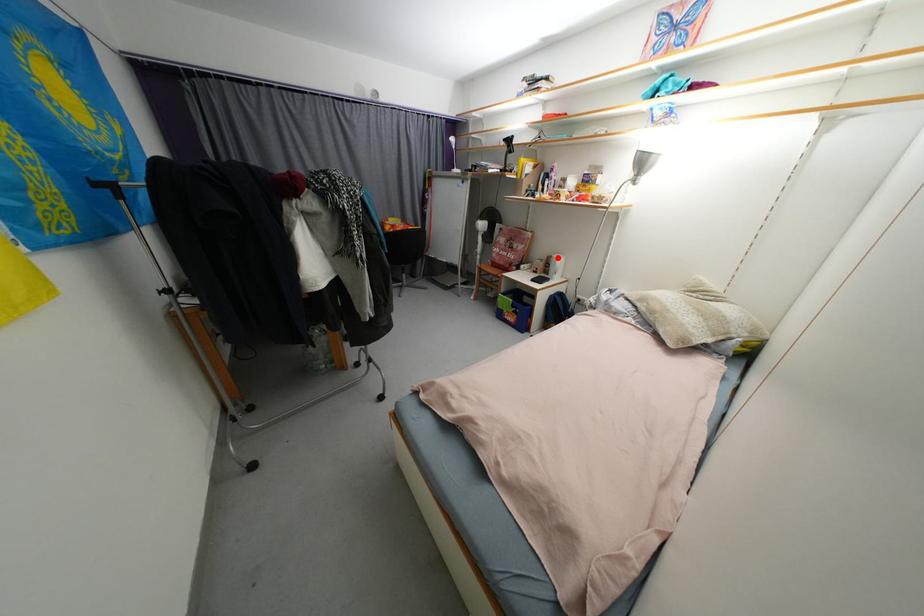
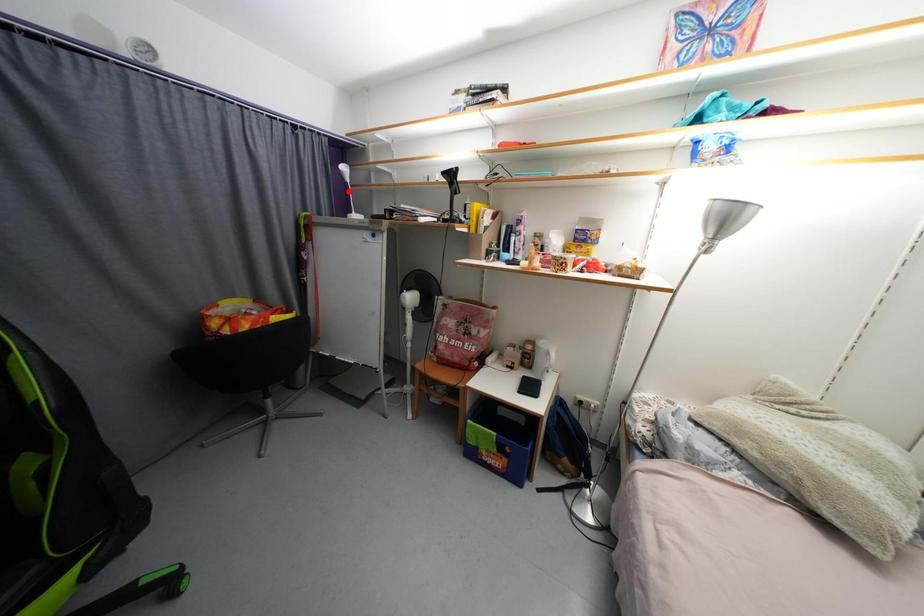
I am providing you with two images of the same scene from different viewpoints. A red point is marked on the first image and another point is marked on the second image. Is the marked point in image1 the same physical position as the marked point in image2?

No